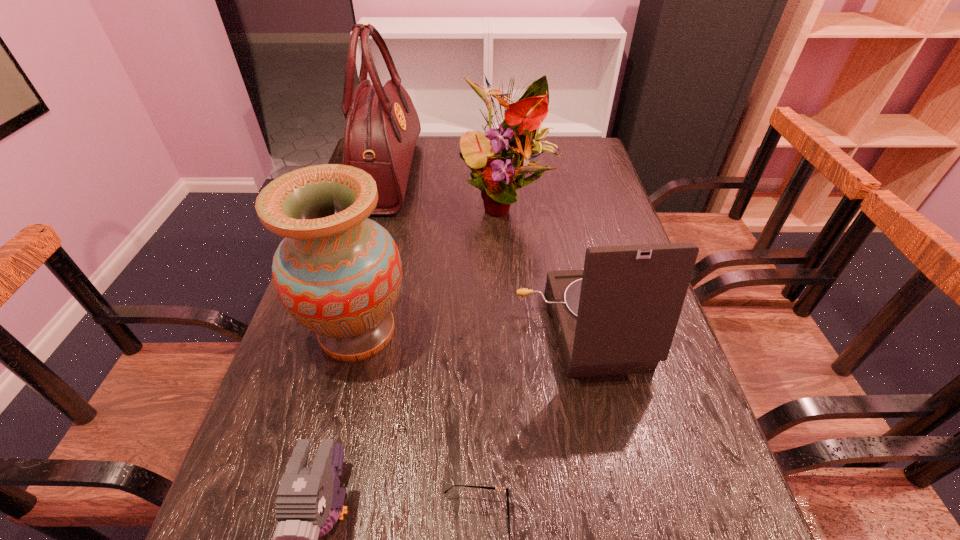
In order to click on vase that is positioned at the left edge in this screenshot , I will do `click(337, 273)`.

You are a GUI agent. You are given a task and a screenshot of the screen. Output one action in this format:
    pyautogui.click(x=<x>, y=<y>)
    Task: Click on the object situated at the right edge
    This screenshot has width=960, height=540.
    Given the screenshot: What is the action you would take?
    pyautogui.click(x=618, y=315)

I want to click on object that is at the far left corner, so click(382, 126).

Locate an element on the screen. free space at the left edge of the desktop is located at coordinates (237, 512).

In the image, there is a desktop. Where is `vacant area at the right edge`? The height and width of the screenshot is (540, 960). vacant area at the right edge is located at coordinates click(x=655, y=417).

Find the location of a particular element. vacant space that's between the bouquet and the phonograph record is located at coordinates pyautogui.click(x=542, y=266).

In order to click on free space between the handbag and the phonograph record in this screenshot , I will do `click(484, 252)`.

Identify which object is located as the third nearest to the bouquet. Please provide its 2D coordinates. Your answer should be formatted as a tuple, i.e. [(x, y)], where the tuple contains the x and y coordinates of a point satisfying the conditions above.

[(337, 273)]

Find the location of a particular element. The image size is (960, 540). object that is the third nearest to the vase is located at coordinates (493, 488).

Image resolution: width=960 pixels, height=540 pixels. I want to click on vacant space that satisfies the following two spatial constraints: 1. on the back side of the phonograph record; 2. on the front-facing side of the tallest object, so click(547, 174).